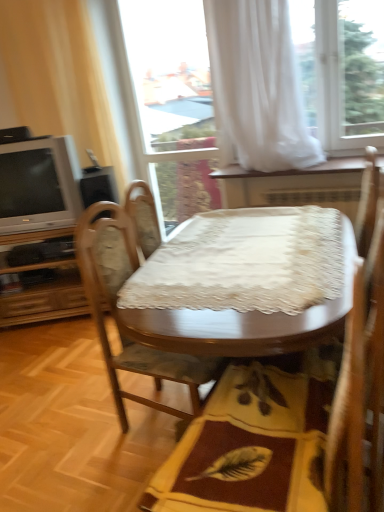
Question: From a real-world perspective, is yellow fabric mat at center physically located above or below transparent glass door at upper center?

Choices:
 (A) above
 (B) below

Answer: (B)

Question: Considering the positions of yellow fabric mat at center and transparent glass door at upper center in the image, is yellow fabric mat at center taller or shorter than transparent glass door at upper center?

Choices:
 (A) tall
 (B) short

Answer: (B)

Question: Which is nearer to the wooden dresser at left?

Choices:
 (A) transparent glass door at upper center
 (B) matte silver television at left
 (C) wooden table at center
 (D) wooden chair at center
 (E) yellow fabric mat at center

Answer: (B)

Question: Estimate the real-world distances between objects in this image. Which object is closer to the yellow fabric mat at center?

Choices:
 (A) wooden chair at center
 (B) beige fabric curtain at left, which is counted as the 1th curtain, starting from the left
 (C) matte silver television at left
 (D) transparent glass door at upper center
 (E) white sheer curtain at upper center, which ranks as the first curtain in right-to-left order

Answer: (A)